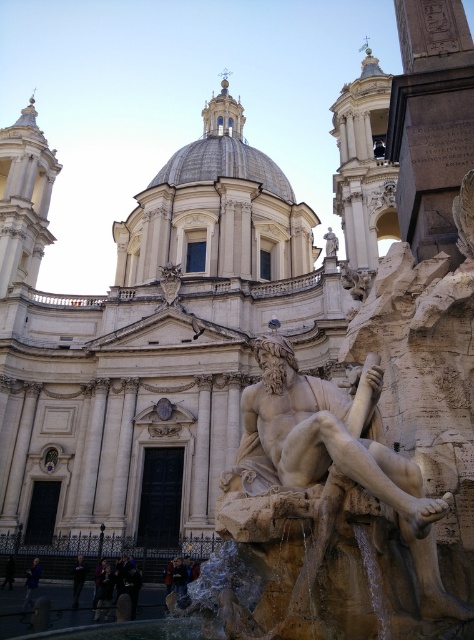
You are standing in front of the grand Romanesque building and want to determine the relative positions of two points marked on the structure. Which of the two points, point (407, 576) or point (30, 592), is closer to you?

Point (407, 576) is closer to the viewer than point (30, 592).

Looking at this image, you are standing at the entrance of the grand Romanesque building and want to find the brown stone statue at center. According to the architectural layout, where should you look relative to the entrance?

The brown stone statue at center is located at coordinates point [328,512] relative to the entrance, which means it is positioned to the right and slightly forward from the entrance.